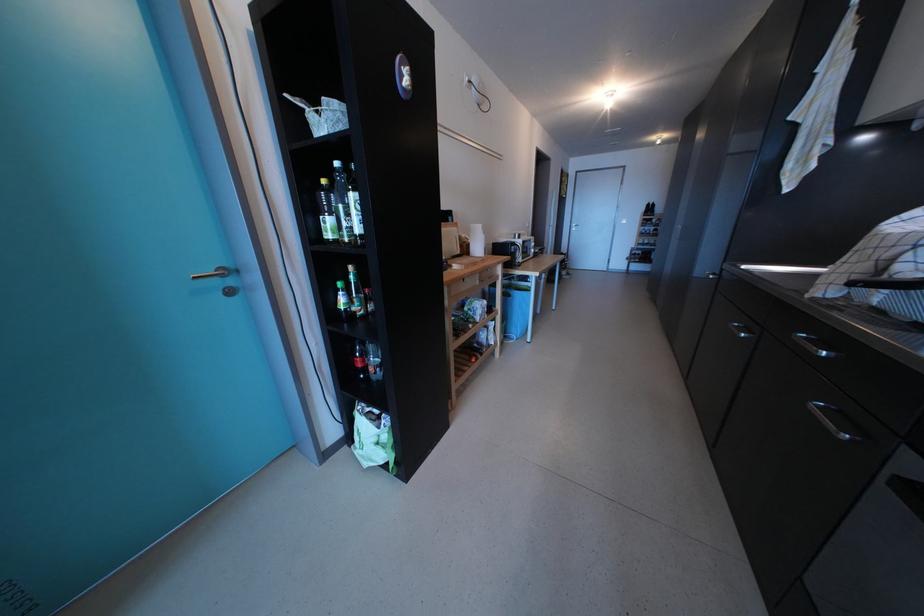
In order to click on dark glass bottle in this screenshot , I will do `click(326, 212)`.